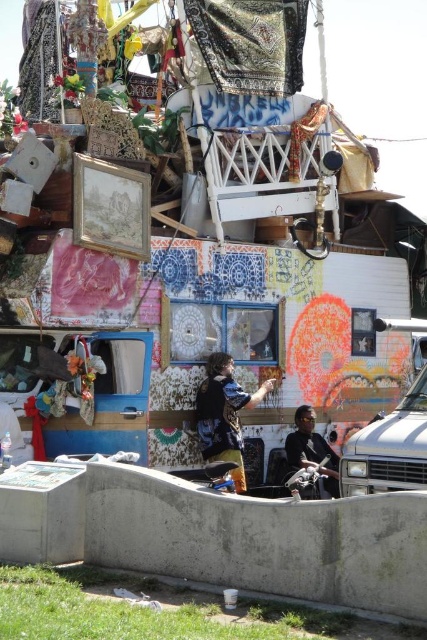
You are standing in front of the trailer and notice two trucks nearby. Which truck is positioned to the left of the other? The options are the white painted truck at center and the white matte truck at right.

The white painted truck at center is positioned to the left of the white matte truck at right.

You are standing in front of the trailer and want to reach both the point at coordinates (374, 272) and the point at coordinates (325, 486). Which point should you approach first to reach the closer one first?

Point (374, 272) is closer to you than point (325, 486), so you should approach point (374, 272) first.